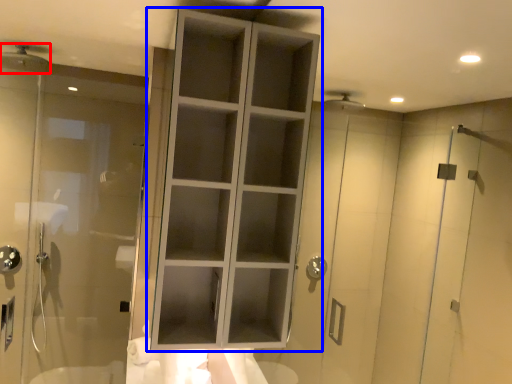
Question: Which of the following is the closest to the observer, shower (highlighted by a red box) or cupboard (highlighted by a blue box)?

Choices:
 (A) shower
 (B) cupboard

Answer: (B)